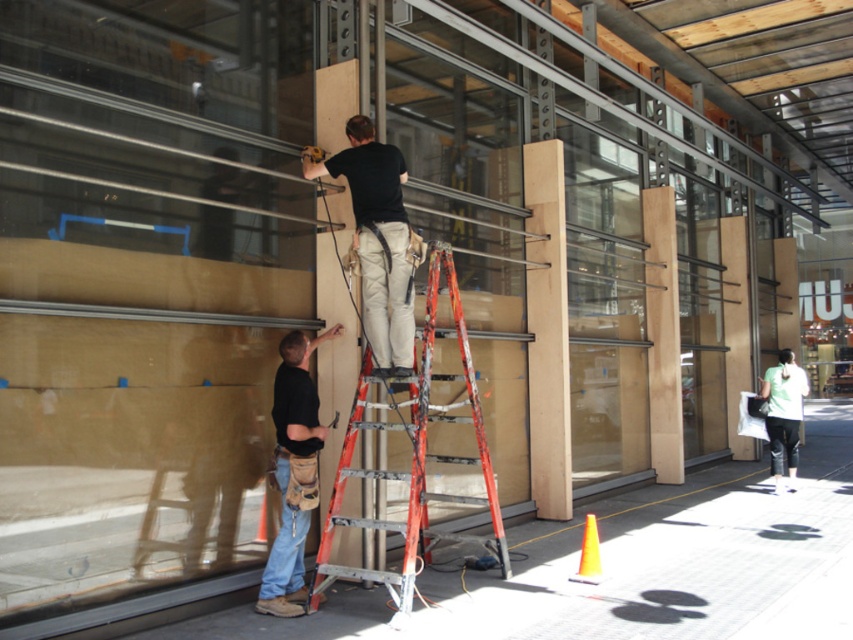
Does point (402, 246) lie behind point (300, 458)?

Yes.

Image resolution: width=853 pixels, height=640 pixels. Find the location of `black matte harness at center`. black matte harness at center is located at coordinates (376, 241).

Between point (288, 365) and point (769, 372), which one is positioned in front?

Point (288, 365) is in front.

Can you confirm if denim jeans at lower left is wider than green fabric shirt at lower right?

No.

The width and height of the screenshot is (853, 640). Describe the element at coordinates (292, 472) in the screenshot. I see `denim jeans at lower left` at that location.

The image size is (853, 640). In order to click on denim jeans at lower left in this screenshot , I will do (x=292, y=472).

Where is `black matte harness at center`? The height and width of the screenshot is (640, 853). black matte harness at center is located at coordinates (376, 241).

Can you confirm if black matte harness at center is positioned to the left of green fabric shirt at lower right?

Yes, black matte harness at center is to the left of green fabric shirt at lower right.

Describe the element at coordinates (376, 241) in the screenshot. This screenshot has height=640, width=853. I see `black matte harness at center` at that location.

Image resolution: width=853 pixels, height=640 pixels. Find the location of `black matte harness at center`. black matte harness at center is located at coordinates (376, 241).